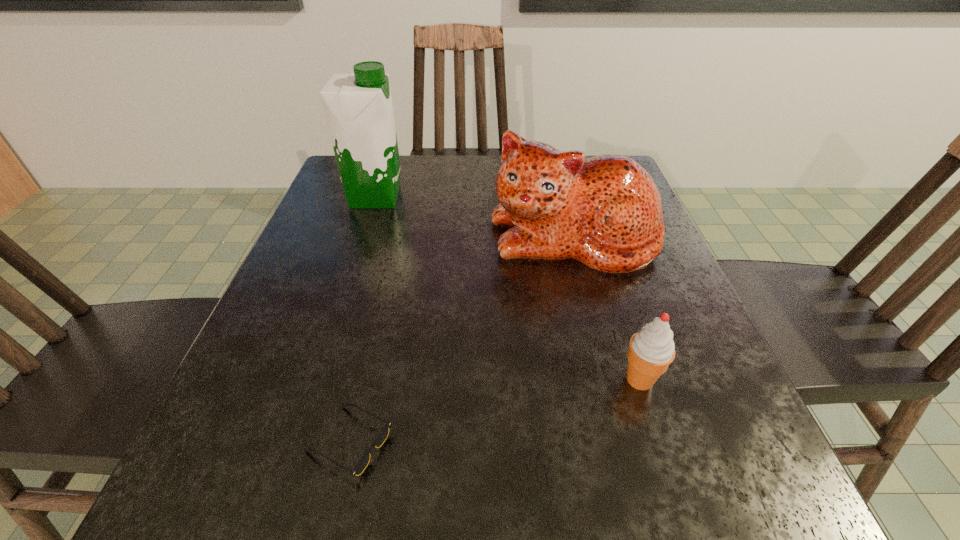
Identify the location of object located in the far edge section of the desktop. (358, 106).

The width and height of the screenshot is (960, 540). What are the coordinates of `object that is at the near edge` in the screenshot? It's located at (380, 439).

Image resolution: width=960 pixels, height=540 pixels. Identify the location of soya milk present at the left edge. (x=358, y=106).

At what (x,y) coordinates should I click in order to perform the action: click on sunglasses positioned at the left edge. Please return your answer as a coordinate pair (x, y). This screenshot has width=960, height=540. Looking at the image, I should click on (380, 439).

Where is `cat that is at the right edge`? The height and width of the screenshot is (540, 960). cat that is at the right edge is located at coordinates (605, 211).

In order to click on icecream that is at the right edge in this screenshot , I will do `click(652, 349)`.

Where is `object positioned at the far left corner`? object positioned at the far left corner is located at coordinates (358, 106).

Where is `object at the near left corner`? This screenshot has width=960, height=540. object at the near left corner is located at coordinates (380, 439).

In the image, there is a desktop. Where is `vacant space at the far edge`? Image resolution: width=960 pixels, height=540 pixels. vacant space at the far edge is located at coordinates (479, 177).

Identify the location of free space at the near edge of the desktop. The height and width of the screenshot is (540, 960). (390, 467).